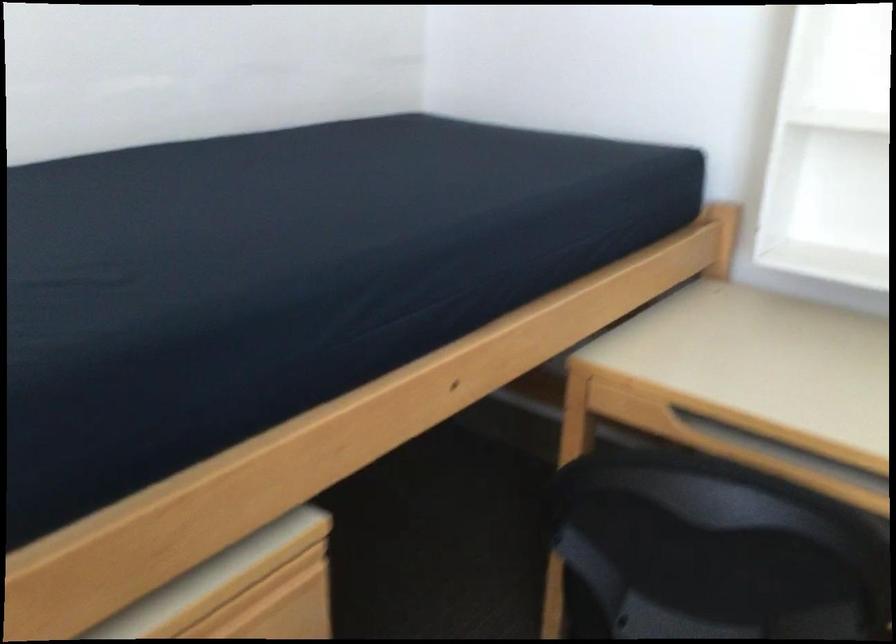
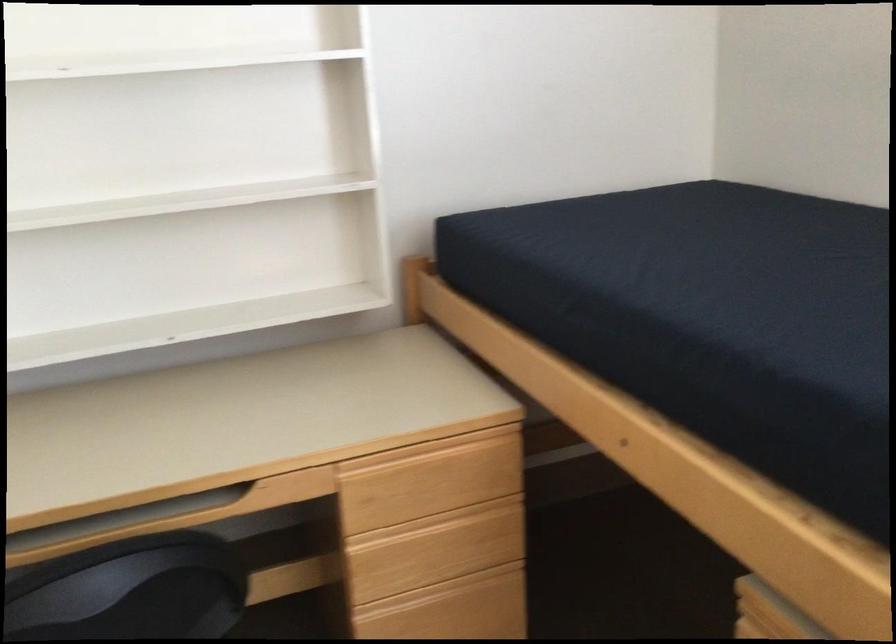
Locate, in the second image, the point that corresponds to (773,442) in the first image.

(96, 529)